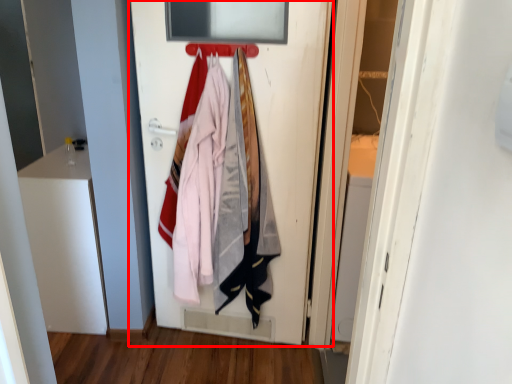
Question: From the image's perspective, considering the relative positions of door (annotated by the red box) and hanger in the image provided, where is door (annotated by the red box) located with respect to the staircase?

Choices:
 (A) below
 (B) above

Answer: (A)